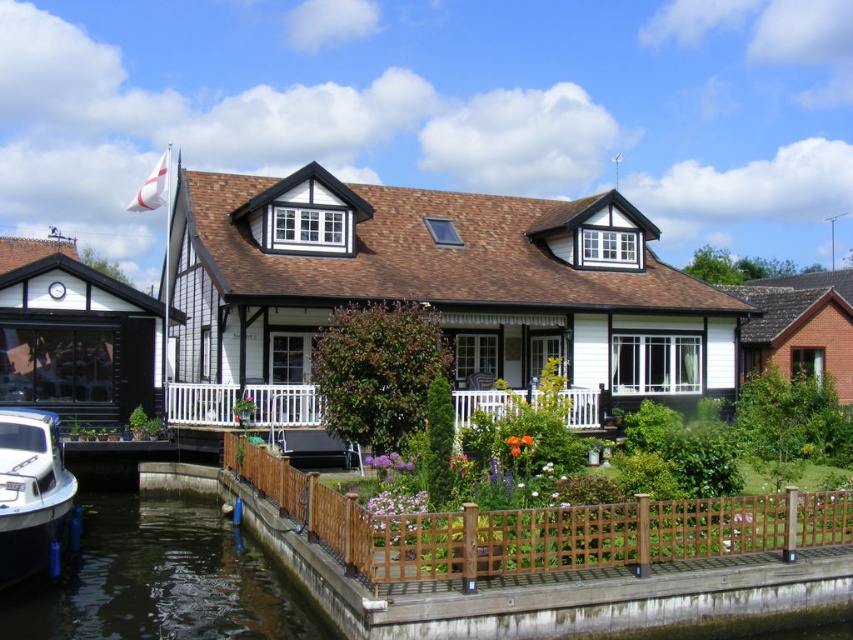
You are planning to host a small garden party and need to decide where to place a 10 square meter tent. Given the available space in the scene, can you fit the tent on the white glossy boat at lower left or the white wooden porch at center?

The white glossy boat at lower left occupies less space than the white wooden porch at center. Therefore, the tent can be placed on the white wooden porch at center as it has more space, but not on the boat due to its smaller size.

You are standing on the wooden fence and looking towards the dark brown water at lower left and the white glossy boat at lower left. Which object is positioned lower in the scene?

The dark brown water at lower left is located below the white glossy boat at lower left, so it is positioned lower in the scene.